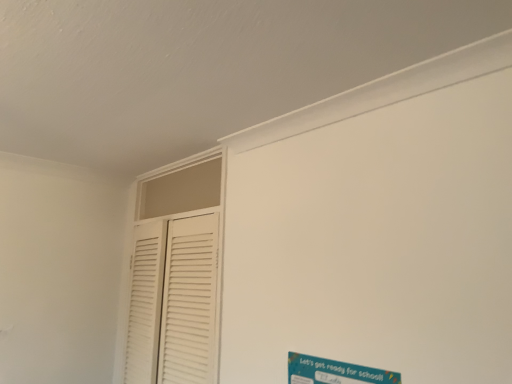
Question: Should I look upward or downward to see blue paper poster at lower right?

Choices:
 (A) down
 (B) up

Answer: (A)